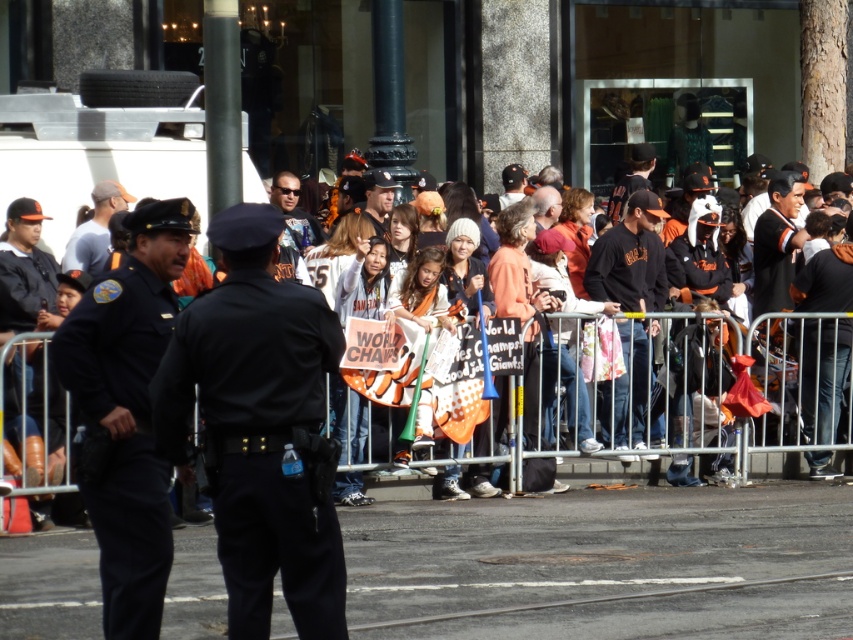
Question: Among these points, which one is farthest from the camera?

Choices:
 (A) tap(704, 470)
 (B) tap(259, 609)

Answer: (A)

Question: Which object is farther from the camera taking this photo?

Choices:
 (A) silver metallic fence at center
 (B) black uniform at center

Answer: (A)

Question: Is the position of black uniform at center more distant than that of silver metallic fence at center?

Choices:
 (A) yes
 (B) no

Answer: (B)

Question: Is black uniform at center thinner than silver metallic fence at center?

Choices:
 (A) no
 (B) yes

Answer: (B)

Question: Can you confirm if black uniform at center is positioned below silver metallic fence at center?

Choices:
 (A) no
 (B) yes

Answer: (A)